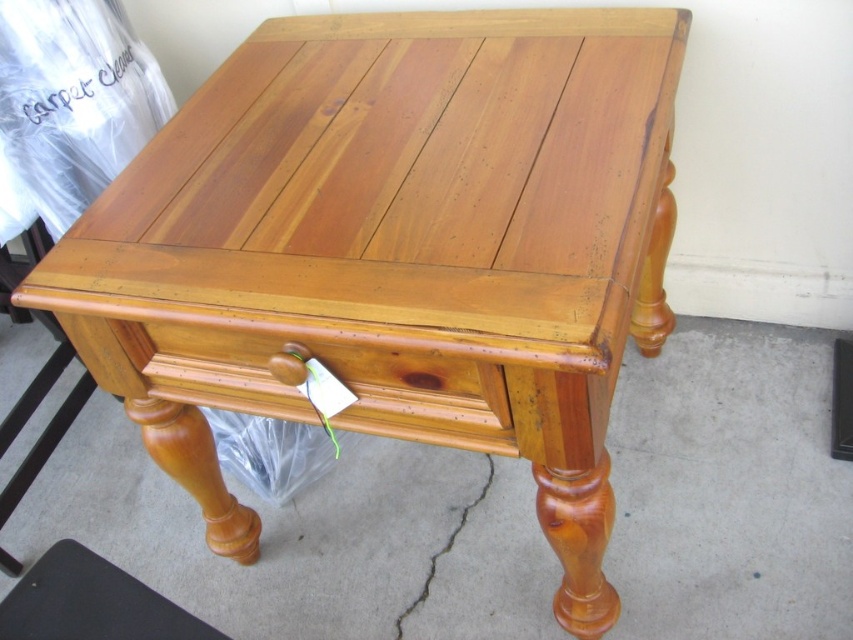
Question: Which object appears farthest from the camera in this image?

Choices:
 (A) satin wood stool at lower left
 (B) satin wood drawer at lower center

Answer: (A)

Question: Can you confirm if satin wood drawer at lower center is smaller than satin wood stool at lower left?

Choices:
 (A) no
 (B) yes

Answer: (A)

Question: Is satin wood drawer at lower center closer to the viewer compared to satin wood stool at lower left?

Choices:
 (A) yes
 (B) no

Answer: (A)

Question: Which object is farther from the camera taking this photo?

Choices:
 (A) satin wood stool at lower left
 (B) satin wood drawer at lower center

Answer: (A)

Question: Can you confirm if satin wood drawer at lower center is positioned below satin wood stool at lower left?

Choices:
 (A) yes
 (B) no

Answer: (B)